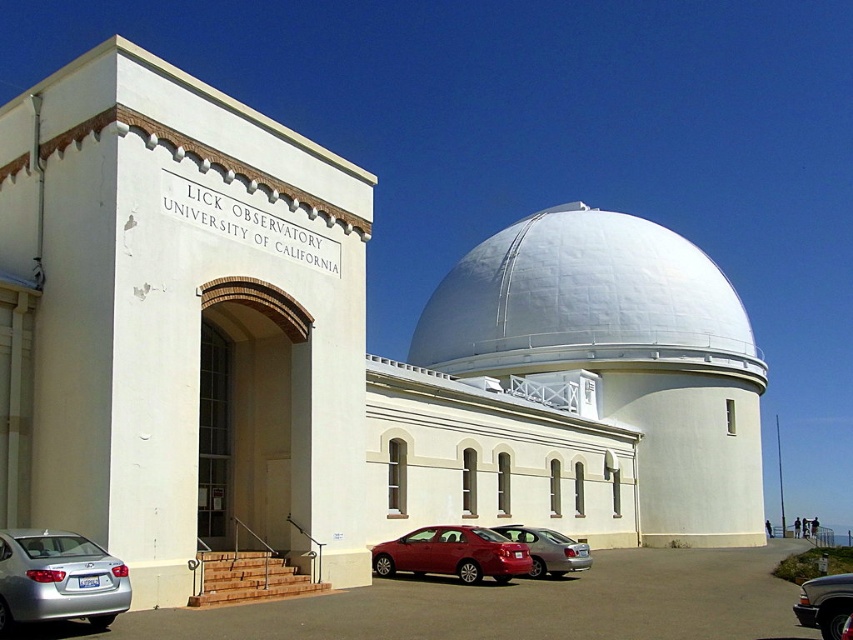
Question: Among these objects, which one is nearest to the camera?

Choices:
 (A) silver metallic sedan at lower left
 (B) shiny red sedan at center

Answer: (A)

Question: Considering the relative positions of silver metallic sedan at lower left and shiny red sedan at center in the image provided, where is silver metallic sedan at lower left located with respect to shiny red sedan at center?

Choices:
 (A) above
 (B) below

Answer: (A)

Question: Which point is closer to the camera?

Choices:
 (A) (805, 609)
 (B) (579, 202)
 (C) (6, 564)

Answer: (C)

Question: Can you confirm if silver metallic car at lower left is bigger than shiny red sedan at center?

Choices:
 (A) no
 (B) yes

Answer: (B)

Question: Can you confirm if metallic silver truck at lower right is wider than metallic red sedan at center?

Choices:
 (A) no
 (B) yes

Answer: (B)

Question: Which point is closer to the camera?

Choices:
 (A) silver metallic car at lower left
 (B) metallic silver truck at lower right
 (C) metallic red sedan at center
 (D) silver metallic sedan at lower left

Answer: (D)